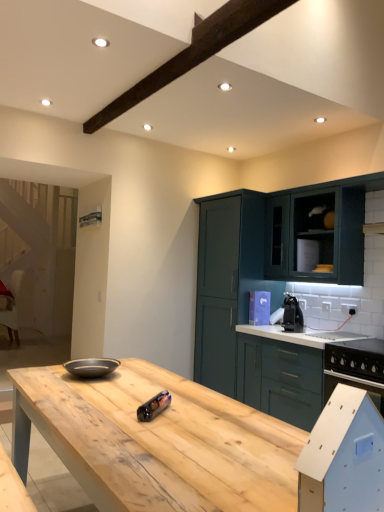
Question: Should I look upward or downward to see metallic cylindrical can at center, the 1th appliance in the front-to-back sequence?

Choices:
 (A) down
 (B) up

Answer: (A)

Question: Can you confirm if natural wood table at center is positioned to the left of metallic cylindrical can at center, placed as the 1th appliance when sorted from left to right?

Choices:
 (A) no
 (B) yes

Answer: (B)

Question: Would you say metallic cylindrical can at center, the 2th appliance when ordered from back to front, is part of natural wood table at center's contents?

Choices:
 (A) no
 (B) yes

Answer: (A)

Question: From the image's perspective, is natural wood table at center under metallic cylindrical can at center, placed as the 1th appliance when sorted from left to right?

Choices:
 (A) no
 (B) yes

Answer: (B)

Question: Does natural wood table at center have a smaller size compared to metallic cylindrical can at center, which ranks as the second appliance in right-to-left order?

Choices:
 (A) yes
 (B) no

Answer: (B)

Question: Is natural wood table at center located outside metallic cylindrical can at center, placed as the 1th appliance when sorted from left to right?

Choices:
 (A) yes
 (B) no

Answer: (A)

Question: Is natural wood table at center next to metallic cylindrical can at center, the second appliance when ordered from top to bottom, and touching it?

Choices:
 (A) no
 (B) yes

Answer: (A)

Question: From the image's perspective, is teal matte cabinet at upper right, which is counted as the first cabinetry, starting from the back, beneath natural wood table at center?

Choices:
 (A) no
 (B) yes

Answer: (A)

Question: Would you say teal matte cabinet at upper right, which is counted as the first cabinetry, starting from the back, is outside natural wood table at center?

Choices:
 (A) yes
 (B) no

Answer: (A)

Question: From the image's perspective, is teal matte cabinet at upper right, which is counted as the first cabinetry, starting from the back, on top of natural wood table at center?

Choices:
 (A) yes
 (B) no

Answer: (A)

Question: Does teal matte cabinet at upper right, the third cabinetry when ordered from front to back, have a greater width compared to natural wood table at center?

Choices:
 (A) no
 (B) yes

Answer: (A)

Question: Is teal matte cabinet at upper right, the third cabinetry when ordered from front to back, shorter than natural wood table at center?

Choices:
 (A) yes
 (B) no

Answer: (B)

Question: From a real-world perspective, is teal matte cabinet at upper right, which is counted as the first cabinetry, starting from the back, over natural wood table at center?

Choices:
 (A) no
 (B) yes

Answer: (B)

Question: Is metallic cylindrical can at center, placed as the 1th appliance when sorted from left to right, taller than green matte cabinet at right, which appears as the third cabinetry when viewed from the back?

Choices:
 (A) no
 (B) yes

Answer: (A)